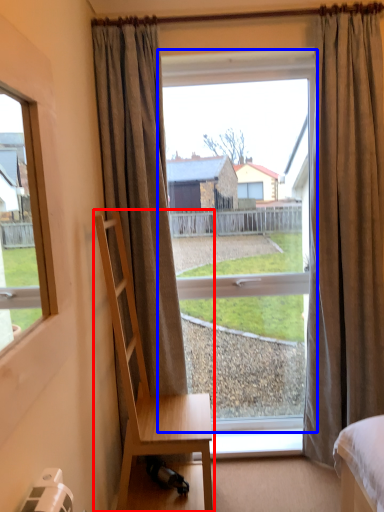
Question: Which of the following is the closest to the observer, chair (highlighted by a red box) or window (highlighted by a blue box)?

Choices:
 (A) chair
 (B) window

Answer: (A)